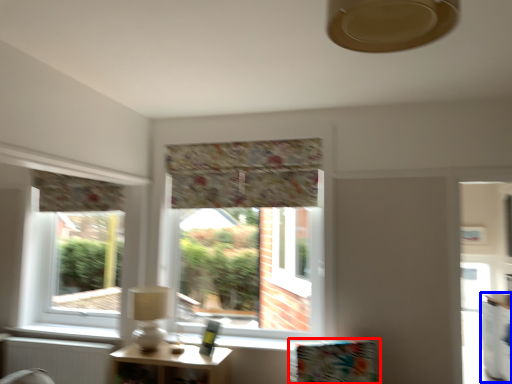
Question: Which object appears farthest to the camera in this image, furniture (highlighted by a red box) or counter (highlighted by a blue box)?

Choices:
 (A) furniture
 (B) counter

Answer: (B)